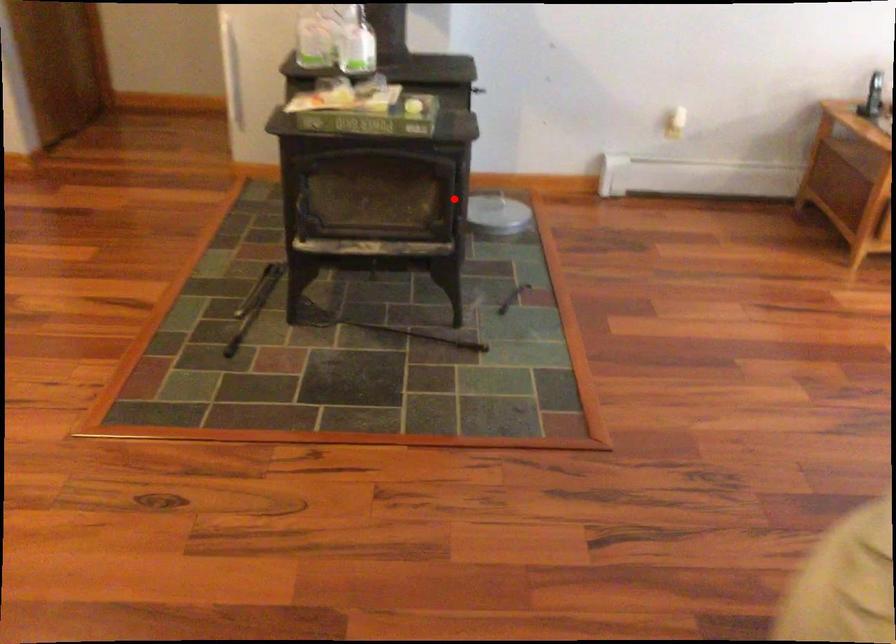
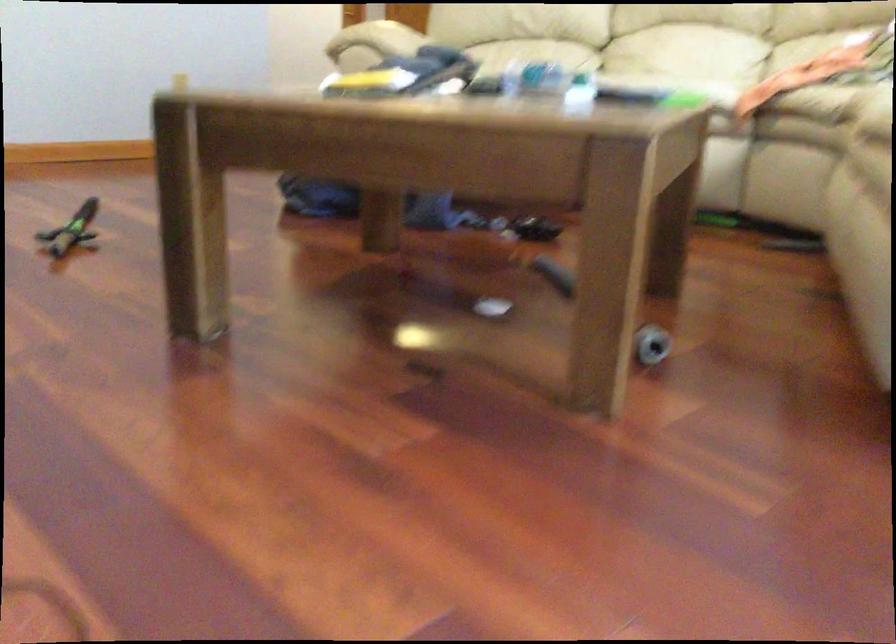
Question: I am providing you with two images of the same scene from different viewpoints. A red point is marked on the first image. Is the red point's position out of view in image 2?

Choices:
 (A) Yes
 (B) No

Answer: (A)